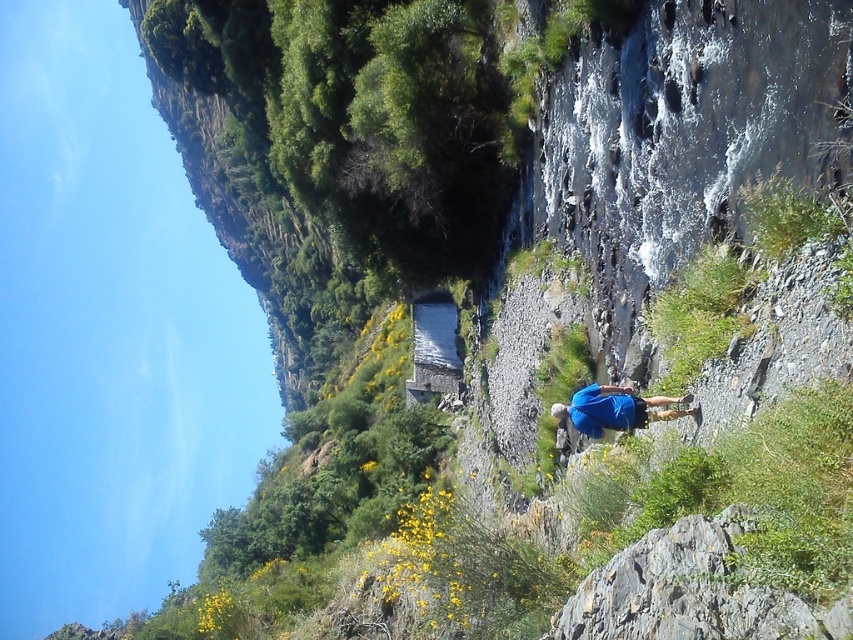
Question: Does gray rough rock at lower right have a smaller size compared to blue fabric shirt at center?

Choices:
 (A) no
 (B) yes

Answer: (A)

Question: Is gray rough rock at lower right thinner than blue fabric shirt at center?

Choices:
 (A) yes
 (B) no

Answer: (B)

Question: Can you confirm if gray rough rock at lower right is positioned below blue fabric shirt at center?

Choices:
 (A) no
 (B) yes

Answer: (B)

Question: Which point is farther to the camera?

Choices:
 (A) gray rough rock at lower right
 (B) blue fabric shirt at center

Answer: (B)